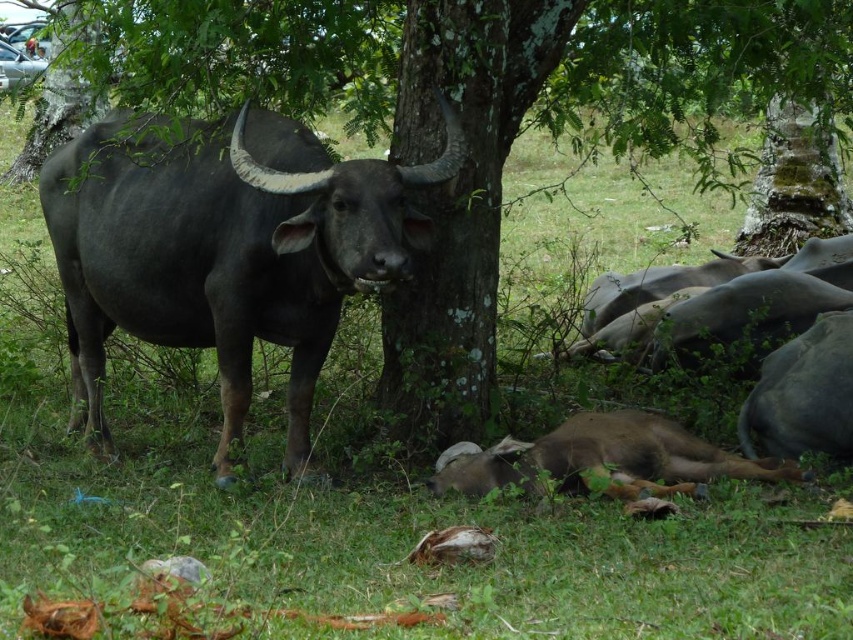
You are a farmer checking the field. You notice the green rough bark tree at center and the shiny black bull at center. Which object is located above the other?

The green rough bark tree at center is positioned over shiny black bull at center.

You are standing at point (497, 118) in the rural scene. What object is located exactly at your current position?

The green rough bark tree at center is located exactly at point (497, 118).

You are a farmer who needs to tie a rope between the dark water buffalo and the green rough bark tree at center. The rope is 4 meters long. Will the rope be sufficient?

The distance between the dark water buffalo and the green rough bark tree at center is 4.06 meters, so the 4 meter rope will be 6 centimeters short. Therefore, the rope is not sufficient.